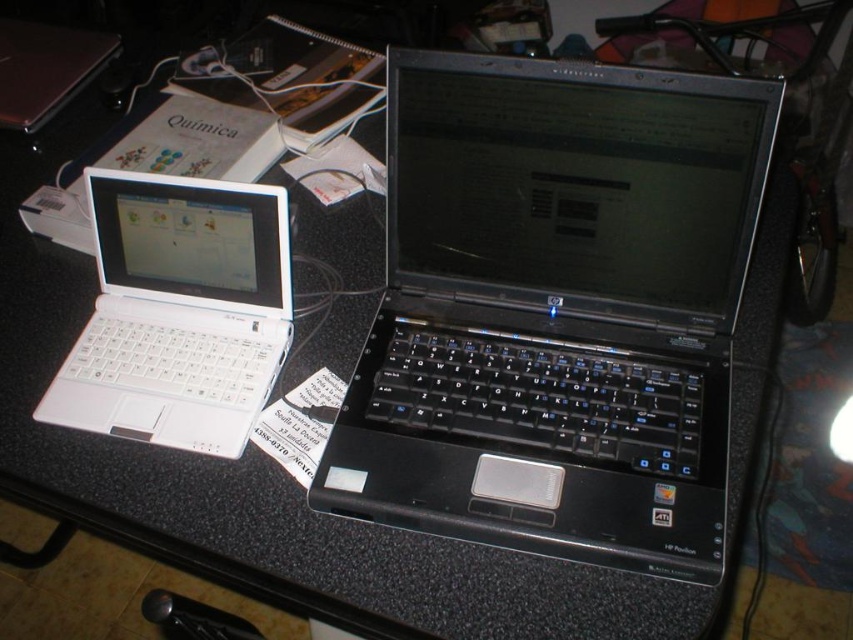
Question: Among these points, which one is nearest to the camera?

Choices:
 (A) (670, 164)
 (B) (231, 349)

Answer: (A)

Question: Does black plastic laptop at center lie behind white matte laptop at left?

Choices:
 (A) yes
 (B) no

Answer: (B)

Question: Which of the following is the closest to the observer?

Choices:
 (A) white matte laptop at left
 (B) black plastic laptop at center
 (C) white plastic laptop at left

Answer: (B)

Question: Does black plastic laptop at center have a larger size compared to white matte laptop at left?

Choices:
 (A) yes
 (B) no

Answer: (A)

Question: Can you confirm if black plastic laptop at center is bigger than white plastic laptop at left?

Choices:
 (A) yes
 (B) no

Answer: (A)

Question: Which of the following is the farthest from the observer?

Choices:
 (A) (277, 202)
 (B) (103, 51)

Answer: (B)